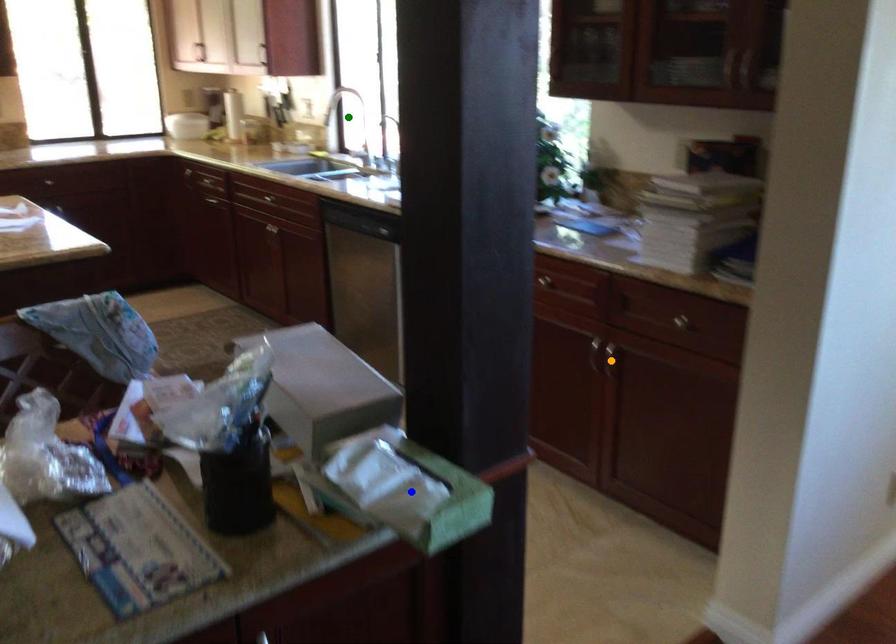
Order these from nearest to farthest:
orange point, green point, blue point

blue point < orange point < green point